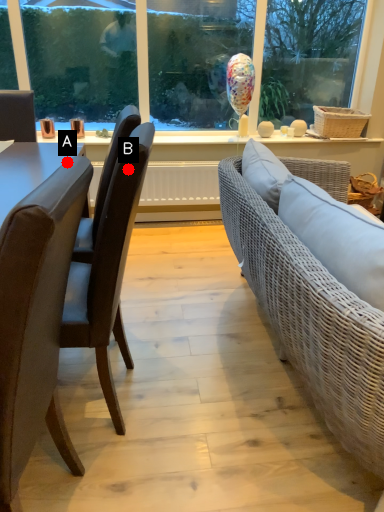
Question: Two points are circled on the image, labeled by A and B beside each circle. Which point is closer to the camera?

Choices:
 (A) A is closer
 (B) B is closer

Answer: (A)